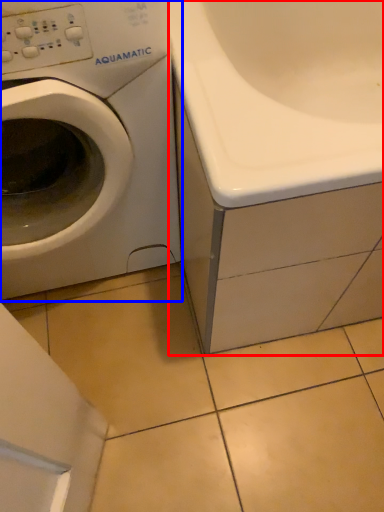
Question: Which object is further to the camera taking this photo, bath (highlighted by a red box) or washing machine (highlighted by a blue box)?

Choices:
 (A) bath
 (B) washing machine

Answer: (A)